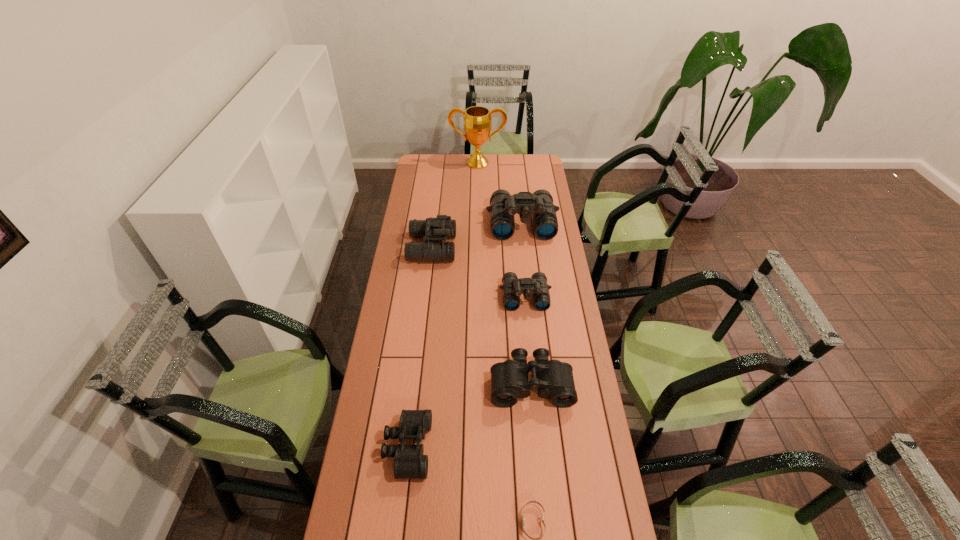
You are a GUI agent. You are given a task and a screenshot of the screen. Output one action in this format:
    pyautogui.click(x=<x>, y=<y>)
    Task: Click on the farthest object
    Image resolution: width=960 pixels, height=540 pixels.
    Given the screenshot: What is the action you would take?
    pyautogui.click(x=477, y=122)

Image resolution: width=960 pixels, height=540 pixels. What are the coordinates of `gold award` in the screenshot? It's located at (477, 122).

I want to click on the tallest binoculars, so click(503, 206).

Identify the location of the second tallest object. (503, 206).

The width and height of the screenshot is (960, 540). Find the location of `the leftmost blue binoculars`. the leftmost blue binoculars is located at coordinates (442, 227).

I want to click on the third tallest object, so click(x=442, y=227).

The image size is (960, 540). Identify the location of the fourth nearest object. (512, 288).

Find the location of a particular element. the smallest blue binoculars is located at coordinates (512, 288).

What are the coordinates of `the right black binoculars` in the screenshot? It's located at (509, 380).

This screenshot has height=540, width=960. I want to click on the farther black binoculars, so click(509, 380).